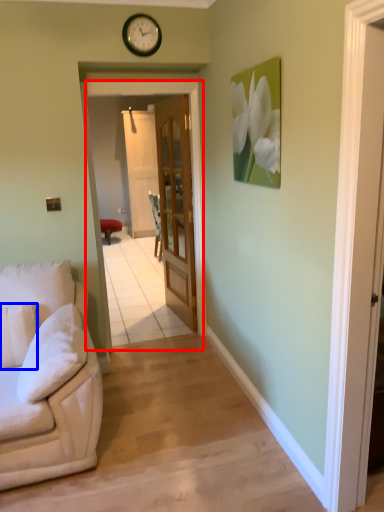
Question: Which of the following is the closest to the observer, screen door (highlighted by a red box) or pillow (highlighted by a blue box)?

Choices:
 (A) screen door
 (B) pillow

Answer: (B)